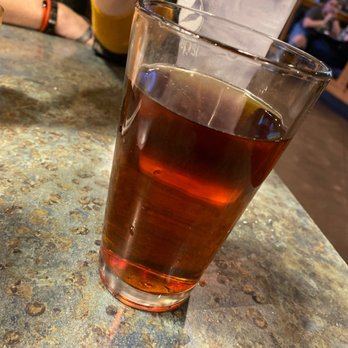
This screenshot has height=348, width=348. Identify the location of floor. (330, 142).